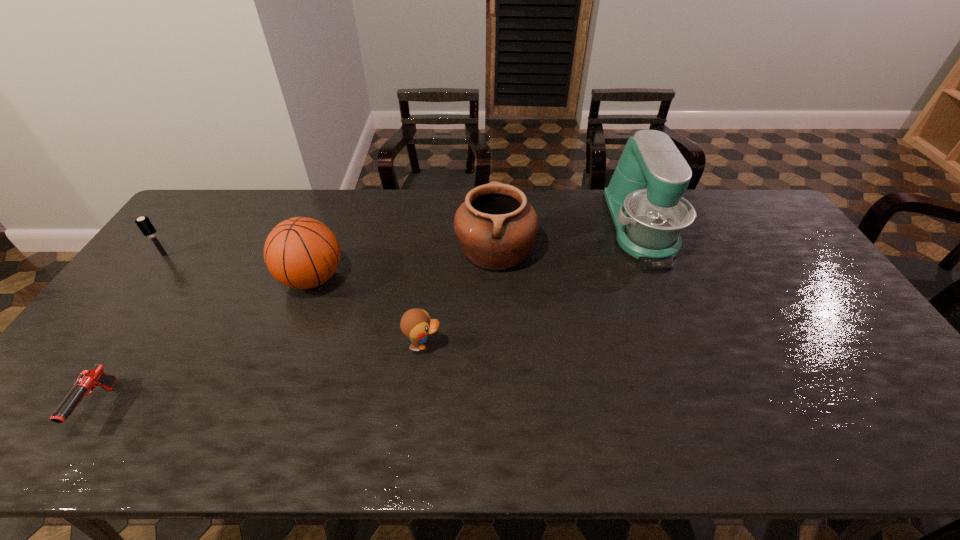
At what (x,y) coordinates should I click in order to perform the action: click on mixer. Please return your answer as a coordinate pair (x, y). The width and height of the screenshot is (960, 540). Looking at the image, I should click on (644, 197).

Identify the location of the rightmost object. The image size is (960, 540). (644, 197).

At what (x,y) coordinates should I click in order to perform the action: click on the fourth object from right to left. Please return your answer as a coordinate pair (x, y). This screenshot has height=540, width=960. Looking at the image, I should click on pyautogui.click(x=302, y=253).

At what (x,y) coordinates should I click in order to perform the action: click on the fifth object from left to right. Please return your answer as a coordinate pair (x, y). This screenshot has width=960, height=540. Looking at the image, I should click on (496, 227).

Locate an element on the screen. the leftmost object is located at coordinates (144, 224).

This screenshot has height=540, width=960. Find the location of `the fourth object from left to right`. the fourth object from left to right is located at coordinates (416, 324).

Where is `the fifth tallest object`? This screenshot has height=540, width=960. the fifth tallest object is located at coordinates (416, 324).

The height and width of the screenshot is (540, 960). Identify the location of the nearest object. (88, 380).

I want to click on the shortest object, so click(88, 380).

Locate an element on the screen. vacant space located 0.090m on the front-facing side of the rightmost object is located at coordinates (667, 293).